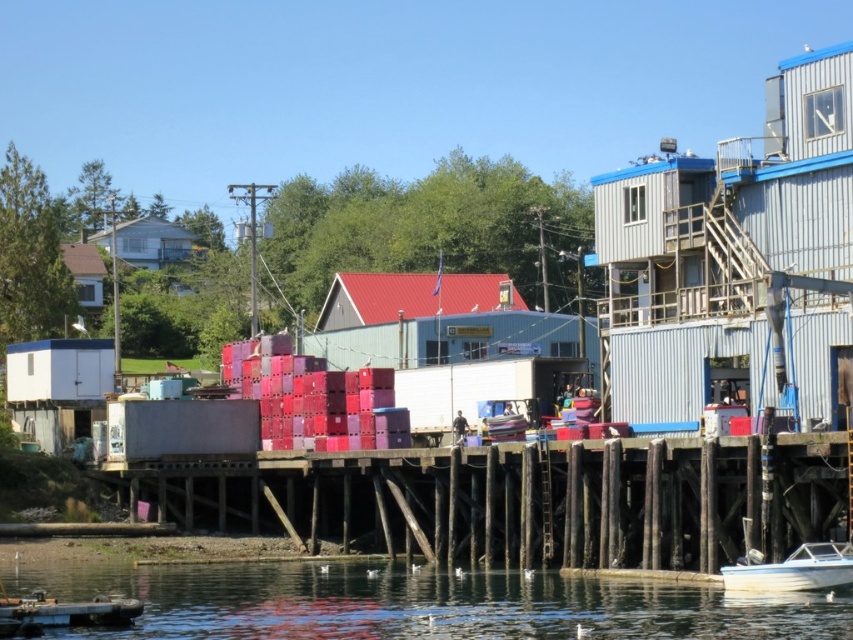
Is metallic corrugated hut at right above white glossy boat at lower right?

Indeed, metallic corrugated hut at right is positioned over white glossy boat at lower right.

Does metallic corrugated hut at right have a smaller size compared to white glossy boat at lower right?

No.

Is point (749, 269) in front of point (809, 586)?

No, (749, 269) is behind (809, 586).

The image size is (853, 640). What are the coordinates of `metallic corrugated hut at right` in the screenshot? It's located at (735, 260).

Which is below, wooden dock at lower center or white glossy boat at lower right?

white glossy boat at lower right is below.

Does wooden dock at lower center appear on the left side of white glossy boat at lower right?

Indeed, wooden dock at lower center is positioned on the left side of white glossy boat at lower right.

Which is in front, point (373, 474) or point (822, 541)?

Positioned in front is point (822, 541).

The width and height of the screenshot is (853, 640). In order to click on wooden dock at lower center in this screenshot , I will do `click(524, 499)`.

Can you confirm if transparent water at lower center is bigger than white glossy boat at lower right?

Yes, transparent water at lower center is bigger than white glossy boat at lower right.

Which is below, transparent water at lower center or white glossy boat at lower right?

transparent water at lower center is below.

Locate an element on the screen. transparent water at lower center is located at coordinates (422, 604).